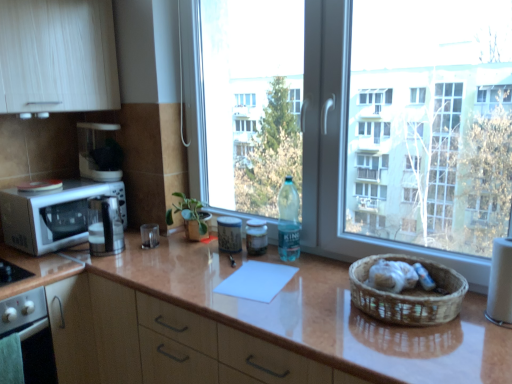
Locate an element on the screen. Image resolution: width=512 pixels, height=384 pixels. vacant space to the left of matte glass jar at center, marked as the third appliance in a left-to-right arrangement is located at coordinates (214, 257).